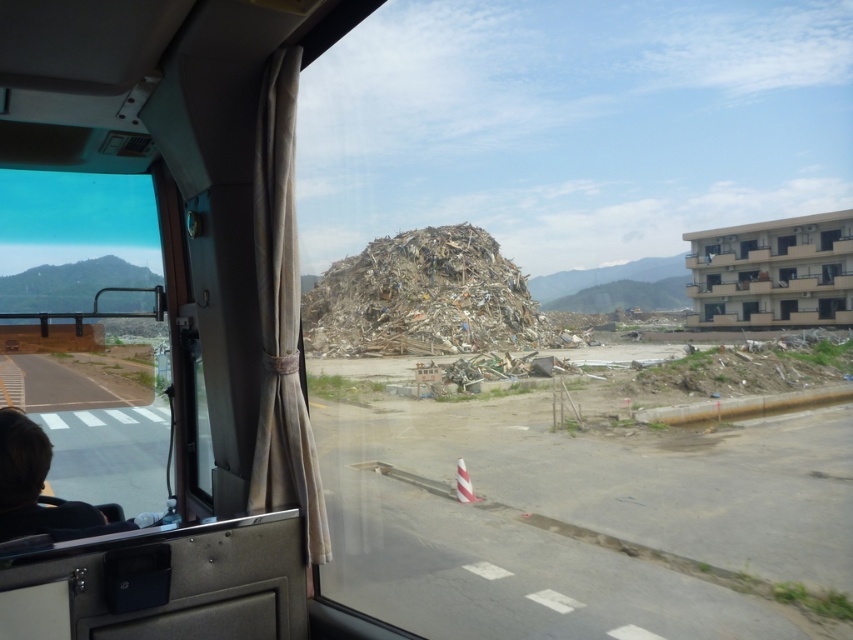
Does brown shredded debris at center appear under transparent glass window at center?

Correct, brown shredded debris at center is located below transparent glass window at center.

From the picture: Is brown shredded debris at center closer to the viewer compared to transparent glass window at center?

Yes, it is in front of transparent glass window at center.

What do you see at coordinates (421, 298) in the screenshot? This screenshot has height=640, width=853. I see `brown shredded debris at center` at bounding box center [421, 298].

This screenshot has width=853, height=640. I want to click on brown shredded debris at center, so click(x=421, y=298).

Which of these two, brown shredded debris at center or dark brown hair at lower left, stands taller?

Standing taller between the two is brown shredded debris at center.

Can you confirm if brown shredded debris at center is positioned below dark brown hair at lower left?

No, brown shredded debris at center is not below dark brown hair at lower left.

Which is behind, point (404, 344) or point (21, 468)?

The point (404, 344) is behind.

Locate an element on the screen. brown shredded debris at center is located at coordinates (421, 298).

Who is more forward, (6,538) or (828,244)?

Point (6,538)

Find the location of a particular element. dark brown hair at lower left is located at coordinates (32, 483).